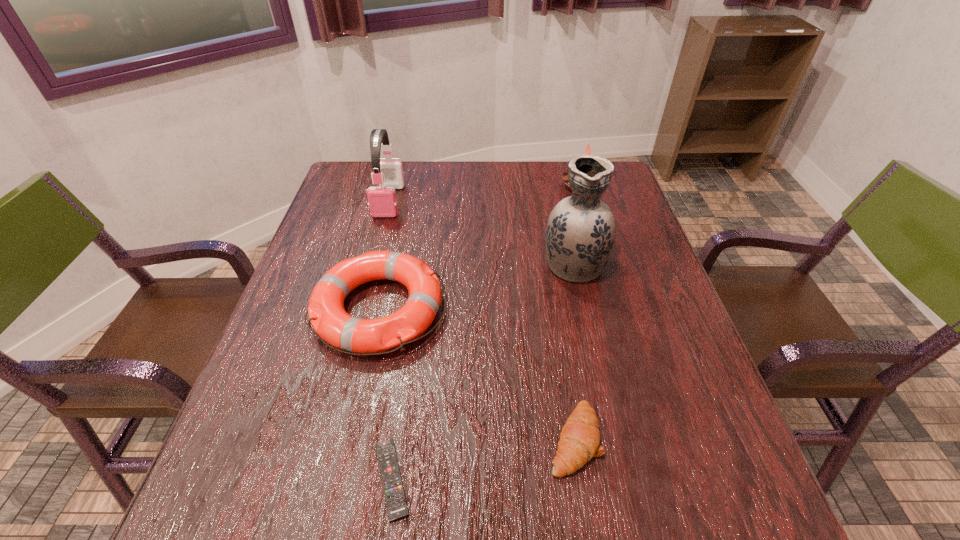
You are a GUI agent. You are given a task and a screenshot of the screen. Output one action in this format:
    pyautogui.click(x=<x>, y=<y>)
    Task: Click on the free location that satisfies the following two spatial constraints: 1. on the outer surface of the crescent roll; 2. on the right side of the fifth shortest object
    This screenshot has height=540, width=960.
    Given the screenshot: What is the action you would take?
    pyautogui.click(x=327, y=440)